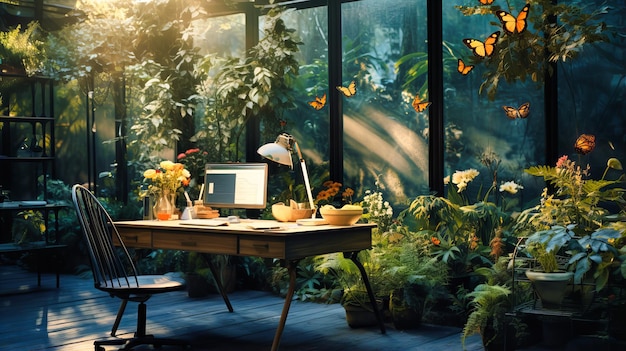
Where is `desk legs`? Image resolution: width=626 pixels, height=351 pixels. desk legs is located at coordinates (118, 319), (227, 298), (285, 306), (366, 280).